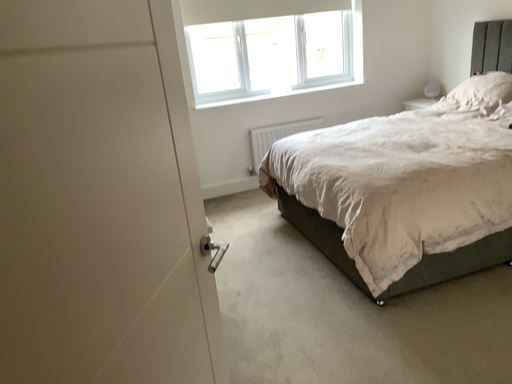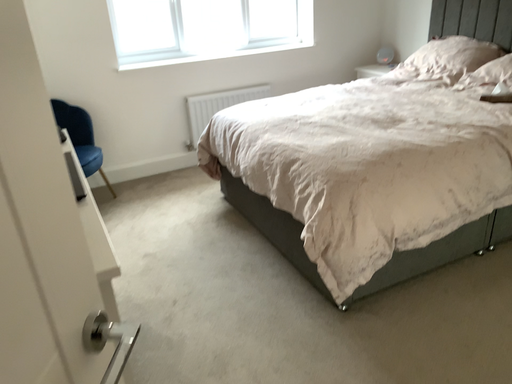
Question: How did the camera likely rotate when shooting the video?

Choices:
 (A) rotated right
 (B) rotated left

Answer: (A)